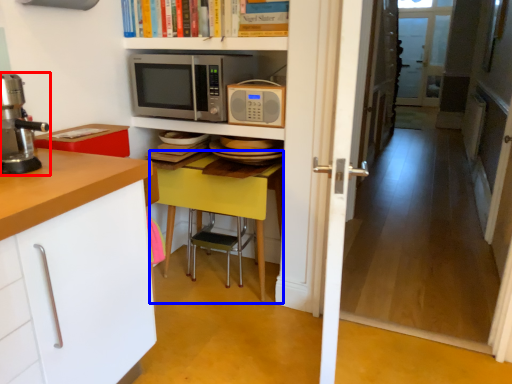
Question: Which object appears closest to the camera in this image, home appliance (highlighted by a red box) or table (highlighted by a blue box)?

Choices:
 (A) home appliance
 (B) table

Answer: (A)